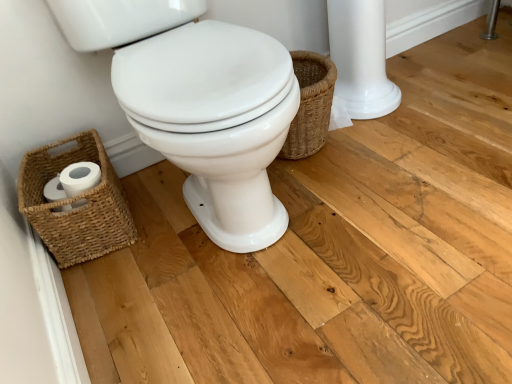
What do you see at coordinates (74, 202) in the screenshot? Image resolution: width=512 pixels, height=384 pixels. I see `woven brown basket at lower left` at bounding box center [74, 202].

You are a GUI agent. You are given a task and a screenshot of the screen. Output one action in this format:
    pyautogui.click(x=<x>, y=<y>)
    Task: Click on the woven brown basket at lower left
    
    Given the screenshot: What is the action you would take?
    pyautogui.click(x=74, y=202)

Where is `woven brown basket at lower left`? The height and width of the screenshot is (384, 512). woven brown basket at lower left is located at coordinates 74,202.